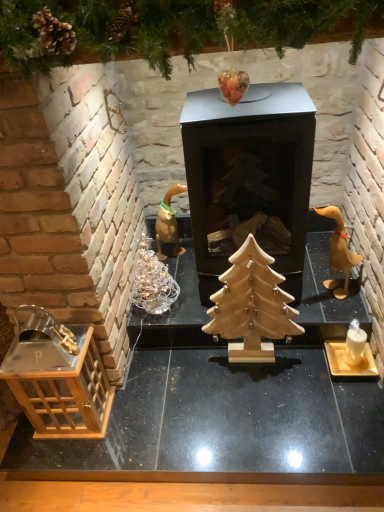
The height and width of the screenshot is (512, 384). Identify the location of vacant space in front of natural wood christmas tree at center. (261, 402).